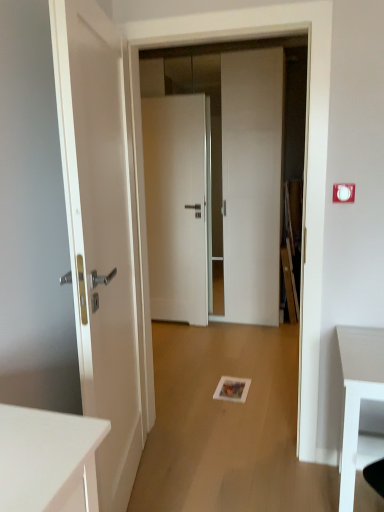
Question: Can you confirm if matte white door at left, which is counted as the 1th door, starting from the front, is shorter than white plastic electric outlet at upper right?

Choices:
 (A) no
 (B) yes

Answer: (A)

Question: Is matte white door at left, which is counted as the 1th door, starting from the front, at the right side of white plastic electric outlet at upper right?

Choices:
 (A) no
 (B) yes

Answer: (A)

Question: Can you confirm if matte white door at left, acting as the 3th door starting from the back, is wider than white plastic electric outlet at upper right?

Choices:
 (A) no
 (B) yes

Answer: (B)

Question: From the image's perspective, is matte white door at left, which is counted as the 1th door, starting from the front, under white plastic electric outlet at upper right?

Choices:
 (A) no
 (B) yes

Answer: (B)

Question: Is white plastic electric outlet at upper right surrounded by matte white door at left, acting as the 3th door starting from the back?

Choices:
 (A) no
 (B) yes

Answer: (A)

Question: Considering the relative sizes of matte white door at left, which is counted as the 1th door, starting from the front, and white plastic electric outlet at upper right in the image provided, is matte white door at left, which is counted as the 1th door, starting from the front, bigger than white plastic electric outlet at upper right?

Choices:
 (A) no
 (B) yes

Answer: (B)

Question: Considering the relative positions of white plastic electric outlet at upper right and matte white door at left, which is counted as the 1th door, starting from the front, in the image provided, is white plastic electric outlet at upper right to the left of matte white door at left, which is counted as the 1th door, starting from the front, from the viewer's perspective?

Choices:
 (A) yes
 (B) no

Answer: (B)

Question: Can you confirm if white plastic electric outlet at upper right is bigger than matte white door at left, which is counted as the 1th door, starting from the front?

Choices:
 (A) no
 (B) yes

Answer: (A)

Question: Would you say white plastic electric outlet at upper right is a long distance from matte white door at left, which is counted as the 1th door, starting from the front?

Choices:
 (A) yes
 (B) no

Answer: (A)

Question: Could matte white door at left, acting as the 3th door starting from the back, be considered to be inside white plastic electric outlet at upper right?

Choices:
 (A) yes
 (B) no

Answer: (B)

Question: Is white plastic electric outlet at upper right smaller than matte white door at left, which is counted as the 1th door, starting from the front?

Choices:
 (A) yes
 (B) no

Answer: (A)

Question: Is white plastic electric outlet at upper right shorter than matte white door at left, acting as the 3th door starting from the back?

Choices:
 (A) yes
 (B) no

Answer: (A)

Question: Considering the relative sizes of matte white door at left, acting as the 3th door starting from the back, and white glossy door at center, the second door when ordered from front to back, in the image provided, is matte white door at left, acting as the 3th door starting from the back, thinner than white glossy door at center, the second door when ordered from front to back,?

Choices:
 (A) yes
 (B) no

Answer: (A)